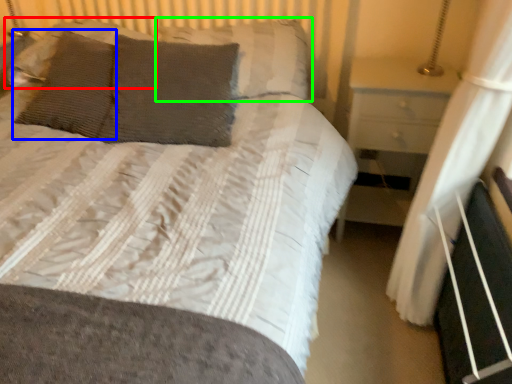
Question: Considering the real-world distances, which object is farthest from pillow (highlighted by a red box)? pillow (highlighted by a blue box) or pillow (highlighted by a green box)?

Choices:
 (A) pillow
 (B) pillow

Answer: (B)